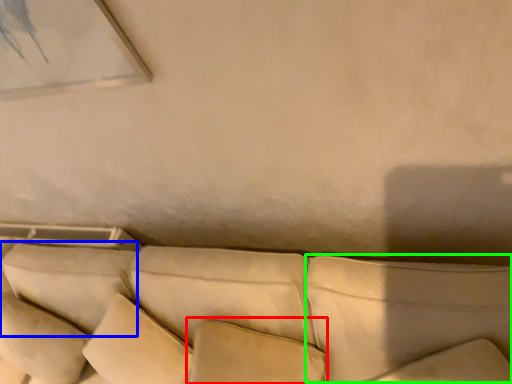
Question: Considering the real-world distances, which object is farthest from pillow (highlighted by a red box)? pillow (highlighted by a blue box) or pillow (highlighted by a green box)?

Choices:
 (A) pillow
 (B) pillow

Answer: (A)